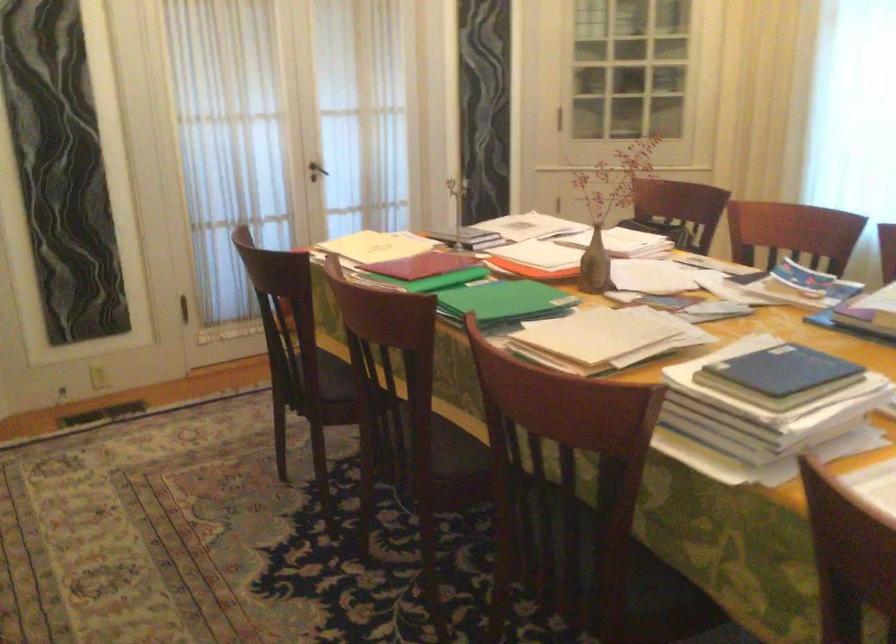
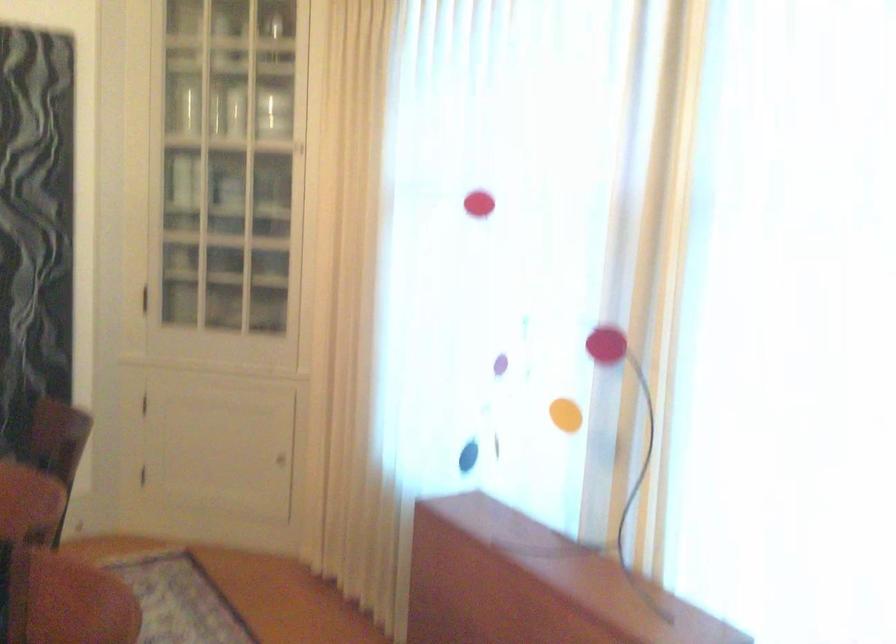
In a continuous first-person perspective shot, in which direction is the camera moving?

The movement direction of the cameraman is right, forward.